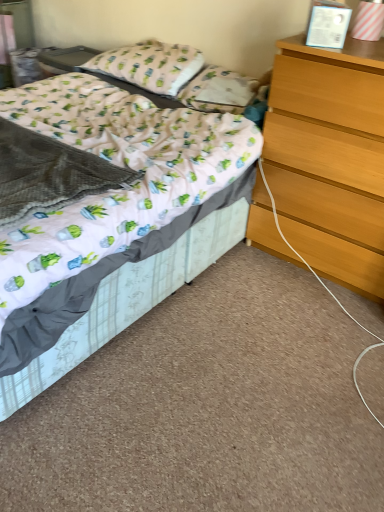
Question: Considering the positions of light brown wooden chest of drawers at right and white fabric pillow at center, the 1th pillow in the right-to-left sequence, in the image, is light brown wooden chest of drawers at right bigger or smaller than white fabric pillow at center, the 1th pillow in the right-to-left sequence,?

Choices:
 (A) small
 (B) big

Answer: (B)

Question: Is point (362, 226) closer or farther from the camera than point (185, 87)?

Choices:
 (A) farther
 (B) closer

Answer: (B)

Question: Estimate the real-world distances between objects in this image. Which object is closer to the light brown wooden chest of drawers at right?

Choices:
 (A) white fabric pillow at upper center, the second pillow viewed from the right
 (B) white fabric pillow at center, positioned as the second pillow in left-to-right order
 (C) white fabric bed at center

Answer: (C)

Question: Which object is the closest to the white fabric bed at center?

Choices:
 (A) light brown wooden chest of drawers at right
 (B) white fabric pillow at center, the 1th pillow in the right-to-left sequence
 (C) white fabric pillow at upper center, the first pillow viewed from the left

Answer: (A)